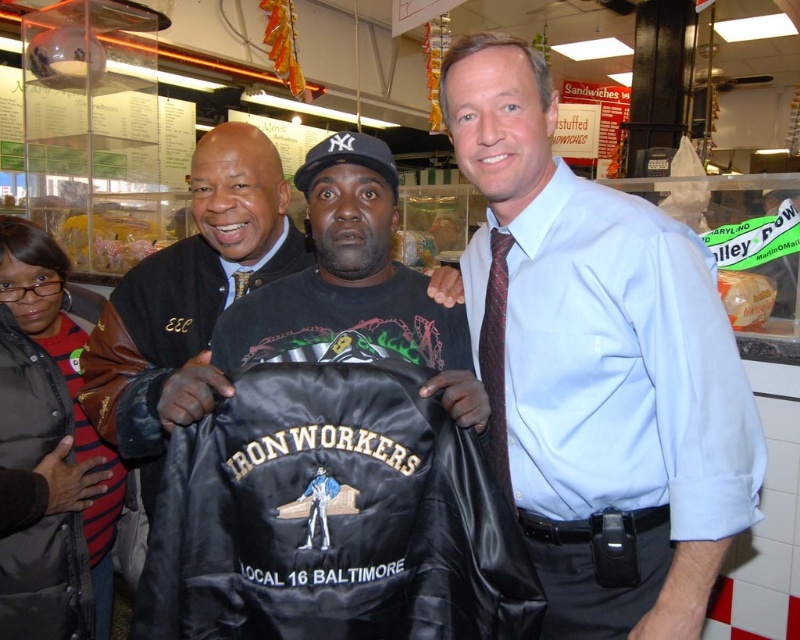
Question: Which of the following is the farthest from the observer?

Choices:
 (A) light blue dress shirt at right
 (B) matte black tie at center
 (C) black leather jacket at center

Answer: (B)

Question: In this image, where is light blue dress shirt at right located relative to black leather jacket at center?

Choices:
 (A) below
 (B) above

Answer: (B)

Question: Is the position of light blue dress shirt at right more distant than that of black leather jacket at center?

Choices:
 (A) yes
 (B) no

Answer: (A)

Question: Can you confirm if black leather jacket at center is wider than black leather jacket at lower left?

Choices:
 (A) yes
 (B) no

Answer: (A)

Question: Among these objects, which one is farthest from the camera?

Choices:
 (A) light blue dress shirt at right
 (B) black leather jacket at lower left
 (C) black satin jacket at center
 (D) matte black tie at center

Answer: (D)

Question: Which point appears closest to the camera in this image?

Choices:
 (A) (496, 285)
 (B) (224, 637)
 (C) (588, 404)
 (D) (236, 284)

Answer: (B)